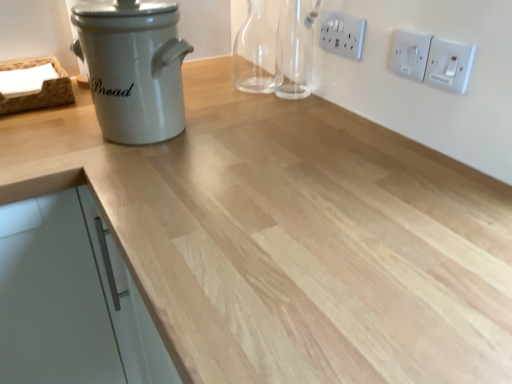
Question: Is white plastic electric outlet at upper right, which is the 1th electric outlet from back to front, thinner than white plastic switch at upper right, which ranks as the 1th electric outlet in right-to-left order?

Choices:
 (A) yes
 (B) no

Answer: (B)

Question: From the image's perspective, does white plastic electric outlet at upper right, positioned as the first electric outlet in left-to-right order, appear lower than white plastic switch at upper right, which ranks as the 1th electric outlet in right-to-left order?

Choices:
 (A) no
 (B) yes

Answer: (A)

Question: Is white plastic electric outlet at upper right, positioned as the third electric outlet in front-to-back order, surrounding white plastic switch at upper right, which is the third electric outlet from back to front?

Choices:
 (A) yes
 (B) no

Answer: (B)

Question: Is white plastic electric outlet at upper right, which is the 1th electric outlet from back to front, far away from white plastic switch at upper right, which ranks as the 1th electric outlet in right-to-left order?

Choices:
 (A) no
 (B) yes

Answer: (A)

Question: Is white plastic electric outlet at upper right, positioned as the third electric outlet in front-to-back order, at the left side of white plastic switch at upper right, marked as the 1th electric outlet in a front-to-back arrangement?

Choices:
 (A) no
 (B) yes

Answer: (B)

Question: From a real-world perspective, is white plastic electric outlet at upper right, which is the 1th electric outlet from back to front, over white plastic switch at upper right, marked as the 1th electric outlet in a front-to-back arrangement?

Choices:
 (A) no
 (B) yes

Answer: (B)

Question: Does white plastic electric outlet at upper right, positioned as the third electric outlet in front-to-back order, appear on the left side of white plastic switch at upper right, which is the second electric outlet from front to back?

Choices:
 (A) yes
 (B) no

Answer: (A)

Question: Is white plastic electric outlet at upper right, positioned as the third electric outlet in front-to-back order, smaller than white plastic switch at upper right, placed as the second electric outlet when sorted from left to right?

Choices:
 (A) yes
 (B) no

Answer: (B)

Question: Is white plastic electric outlet at upper right, which is the 1th electric outlet from back to front, wider than white plastic switch at upper right, placed as the second electric outlet when sorted from left to right?

Choices:
 (A) yes
 (B) no

Answer: (A)

Question: Is white plastic electric outlet at upper right, positioned as the third electric outlet in front-to-back order, facing away from white plastic switch at upper right, which is the second electric outlet from front to back?

Choices:
 (A) yes
 (B) no

Answer: (B)

Question: Is white plastic electric outlet at upper right, which is counted as the third electric outlet, starting from the right, to the right of white plastic switch at upper right, which is the second electric outlet from front to back, from the viewer's perspective?

Choices:
 (A) no
 (B) yes

Answer: (A)

Question: Is white plastic electric outlet at upper right, which is counted as the third electric outlet, starting from the right, taller than white plastic switch at upper right, the 2th electric outlet when ordered from right to left?

Choices:
 (A) no
 (B) yes

Answer: (A)

Question: Considering the relative positions of white plastic electric outlet at upper right, which is counted as the third electric outlet, starting from the right, and white matte cabinet handle at left in the image provided, is white plastic electric outlet at upper right, which is counted as the third electric outlet, starting from the right, to the left of white matte cabinet handle at left from the viewer's perspective?

Choices:
 (A) no
 (B) yes

Answer: (A)